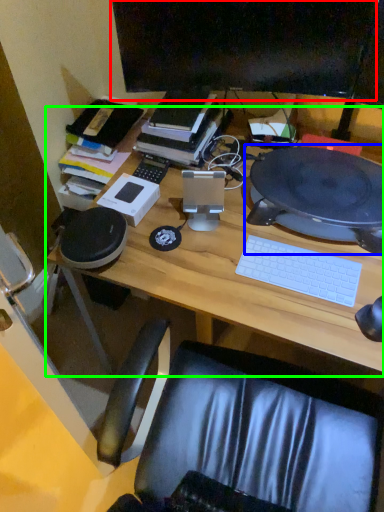
Question: Which is nearer to the computer monitor (highlighted by a red box)? computer (highlighted by a blue box) or desk (highlighted by a green box).

Choices:
 (A) computer
 (B) desk

Answer: (A)